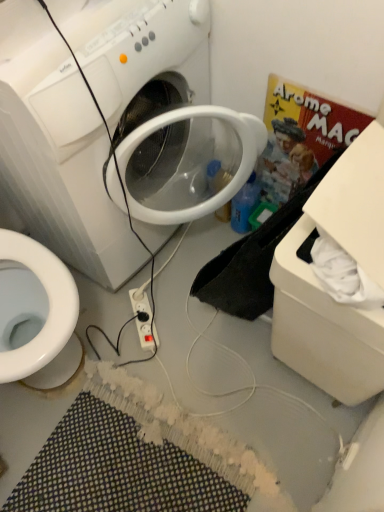
Locate an element on the screen. This screenshot has width=384, height=512. vacant space in multicolored woven bath mat at lower center (from a real-world perspective) is located at coordinates (141, 461).